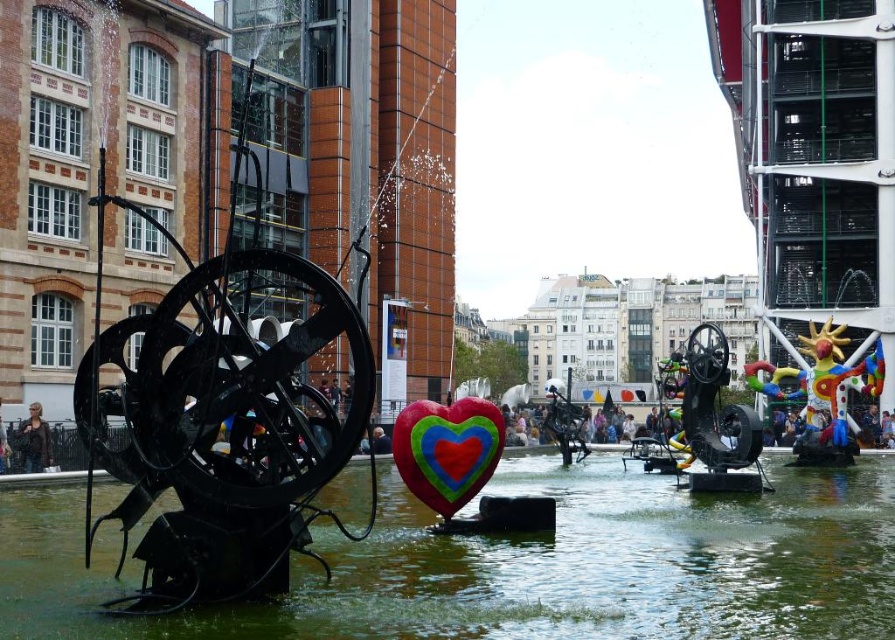
You are a photographer standing in the public fountain area. You want to take a photo that includes both the green metallic water at center and the multicolored fabric heart at center. Which object will appear larger in the photo?

The multicolored fabric heart at center will appear larger in the photo because it is taller than the green metallic water at center.

You are a photographer planning to take a portrait of the smooth skin person at center using a camera with a 1.5 meter focal length. The green metallic water at center is in the background. Will the water appear smaller in the photo compared to the person?

The green metallic water at center is shorter than the smooth skin person at center, so yes, the water will appear smaller in the photo compared to the person because it is physically shorter.